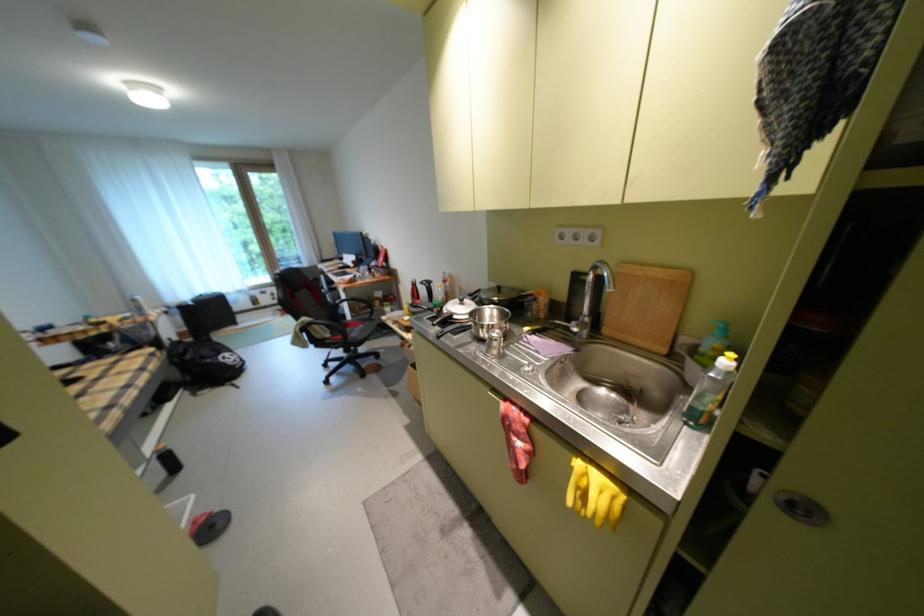
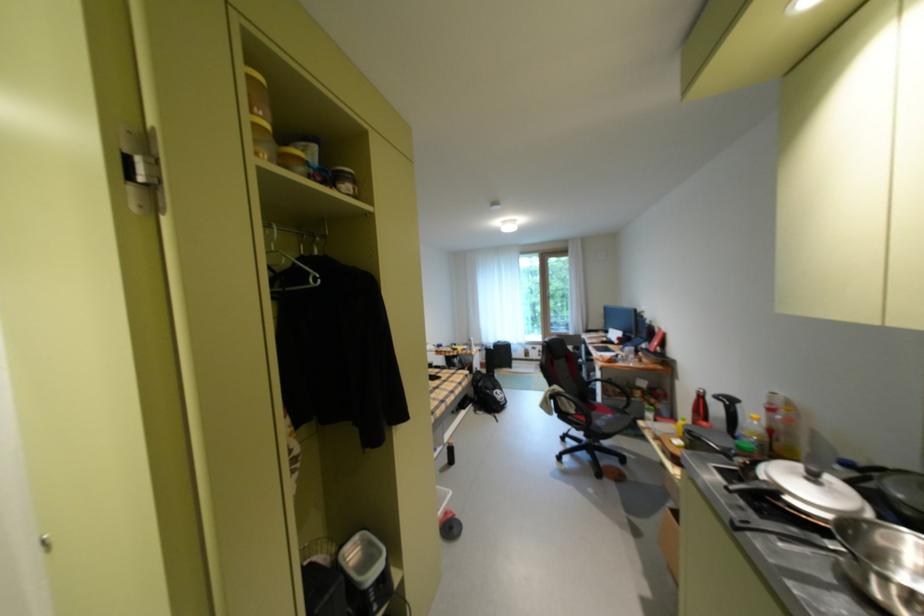
The point at [326,333] is marked in the first image. Where is the corresponding point in the second image?

(573, 405)